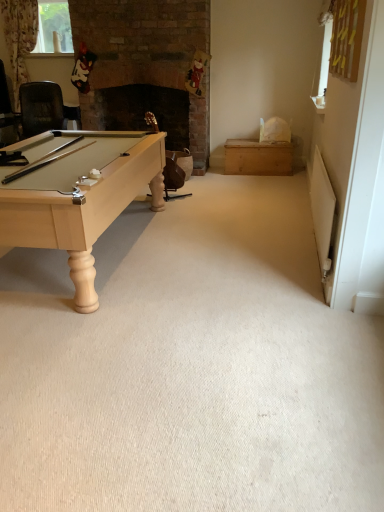
Question: Could you tell me if clear glass window at upper left is facing wooden chest at right?

Choices:
 (A) yes
 (B) no

Answer: (B)

Question: Does clear glass window at upper left have a greater height compared to wooden chest at right?

Choices:
 (A) no
 (B) yes

Answer: (B)

Question: From a real-world perspective, does clear glass window at upper left sit lower than wooden chest at right?

Choices:
 (A) yes
 (B) no

Answer: (B)

Question: Considering the relative sizes of clear glass window at upper left and wooden chest at right in the image provided, is clear glass window at upper left shorter than wooden chest at right?

Choices:
 (A) no
 (B) yes

Answer: (A)

Question: Does clear glass window at upper left have a greater width compared to wooden chest at right?

Choices:
 (A) no
 (B) yes

Answer: (A)

Question: Is wooden chest at right bigger or smaller than clear glass window at upper left?

Choices:
 (A) small
 (B) big

Answer: (B)

Question: From a real-world perspective, is wooden chest at right above or below clear glass window at upper left?

Choices:
 (A) above
 (B) below

Answer: (B)

Question: Considering the positions of point (291, 147) and point (51, 35), is point (291, 147) closer or farther from the camera than point (51, 35)?

Choices:
 (A) closer
 (B) farther

Answer: (A)

Question: In terms of height, does wooden chest at right look taller or shorter compared to clear glass window at upper left?

Choices:
 (A) tall
 (B) short

Answer: (B)

Question: From the image's perspective, is clear glass window at upper left positioned above or below wooden chest at right?

Choices:
 (A) below
 (B) above

Answer: (B)

Question: In terms of size, does clear glass window at upper left appear bigger or smaller than wooden chest at right?

Choices:
 (A) big
 (B) small

Answer: (B)

Question: Is clear glass window at upper left to the left or to the right of wooden chest at right in the image?

Choices:
 (A) right
 (B) left

Answer: (B)

Question: Is clear glass window at upper left in front of or behind wooden chest at right in the image?

Choices:
 (A) front
 (B) behind

Answer: (B)

Question: Choose the correct answer: Is wooden swivel chair at center inside clear glass window at upper left or outside it?

Choices:
 (A) outside
 (B) inside

Answer: (A)

Question: Looking at their shapes, would you say wooden swivel chair at center is wider or thinner than clear glass window at upper left?

Choices:
 (A) thin
 (B) wide

Answer: (B)